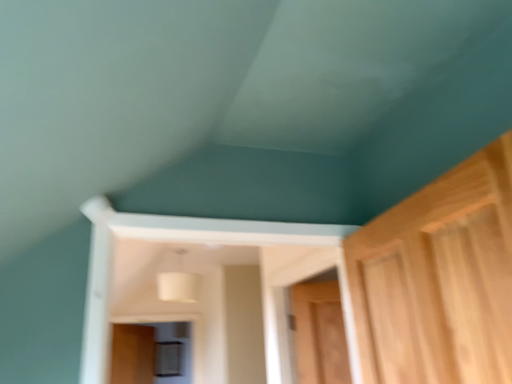
Find the location of a particular element. matte white light fixture at center is located at coordinates (177, 280).

What do you see at coordinates (177, 280) in the screenshot? The image size is (512, 384). I see `matte white light fixture at center` at bounding box center [177, 280].

Find the location of a particular element. Image resolution: width=512 pixels, height=384 pixels. matte white light fixture at center is located at coordinates (177, 280).